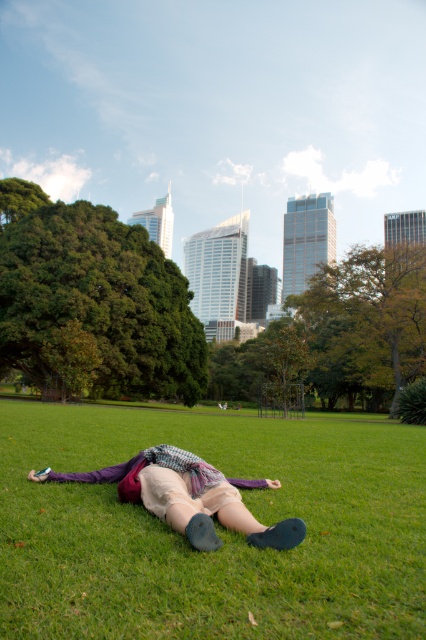
Is point (25, 403) positioned in front of point (287, 548)?

No, (25, 403) is behind (287, 548).

The image size is (426, 640). Describe the element at coordinates (216, 529) in the screenshot. I see `green grass at center` at that location.

Locate an element on the screen. This screenshot has height=640, width=426. green grass at center is located at coordinates (216, 529).